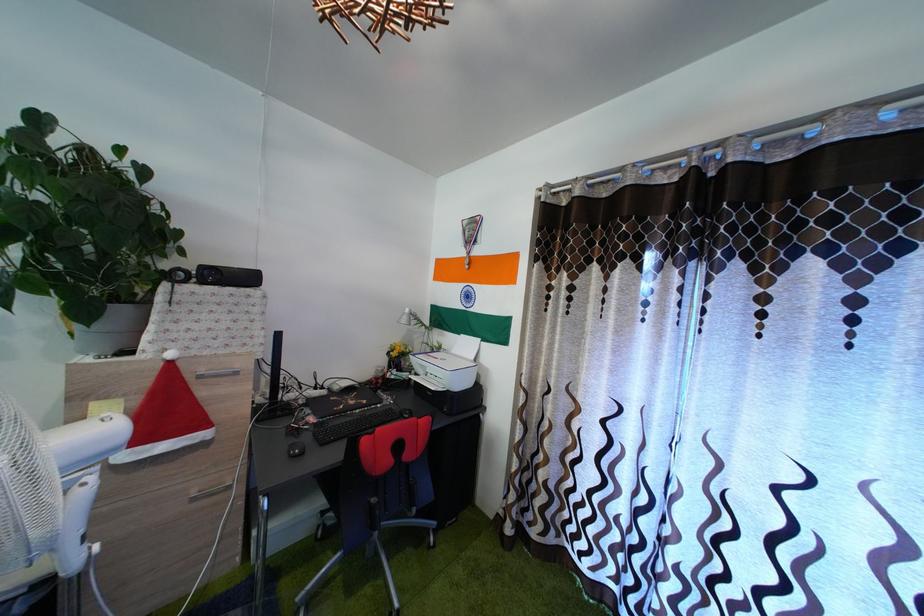
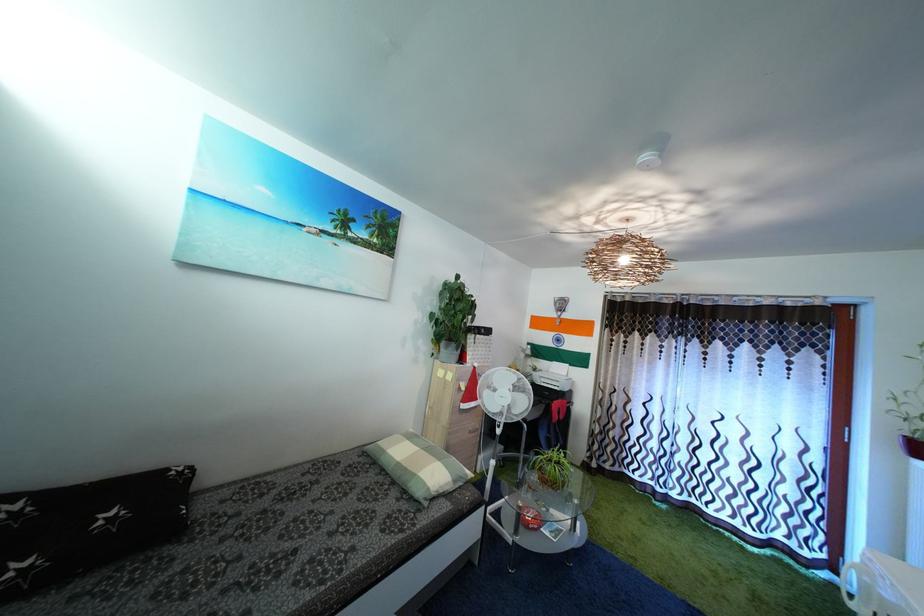
What movement of the cameraman would produce the second image?

The movement direction of the cameraman is left, backward.